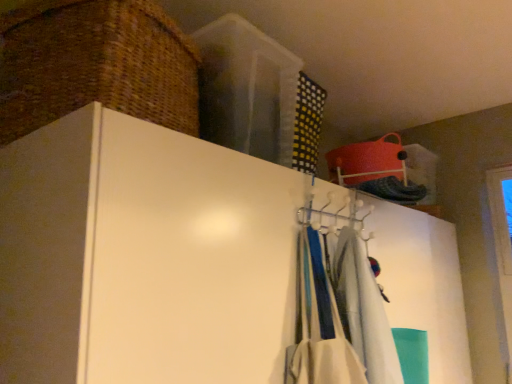
Question: From the image's perspective, is woven brown basket at upper left above or below white fabric scarf at center?

Choices:
 (A) below
 (B) above

Answer: (B)

Question: Looking at their shapes, would you say woven brown basket at upper left is wider or thinner than white fabric scarf at center?

Choices:
 (A) wide
 (B) thin

Answer: (A)

Question: Which object is the farthest from the white plastic hanger at upper center?

Choices:
 (A) woven brown basket at upper left
 (B) white matte cupboard at upper center
 (C) white fabric scarf at center

Answer: (A)

Question: Which object is the farthest from the white matte cupboard at upper center?

Choices:
 (A) white plastic hanger at upper center
 (B) white fabric scarf at center
 (C) woven brown basket at upper left

Answer: (B)